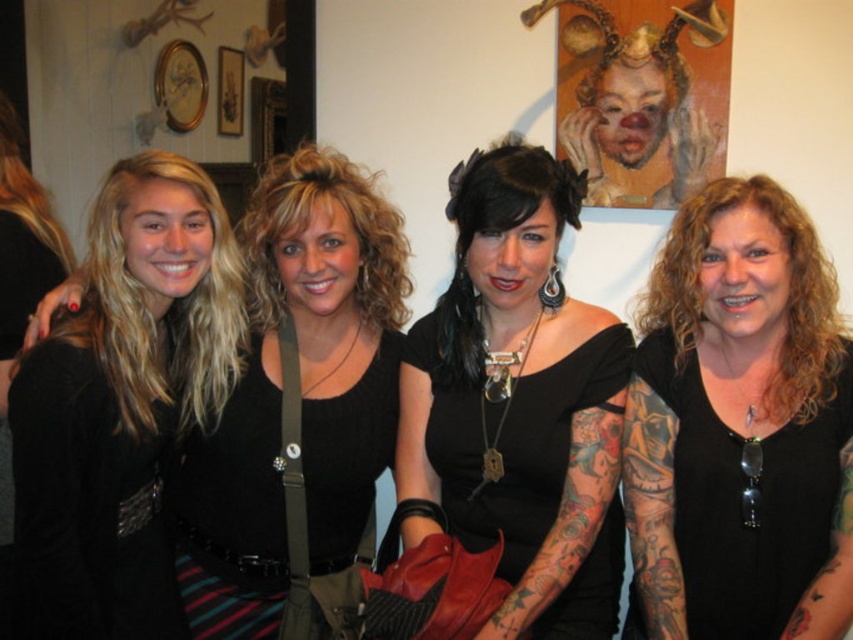
Is black leather jacket at left wider than black knit top at center?

In fact, black leather jacket at left might be narrower than black knit top at center.

Can you confirm if black leather jacket at left is positioned to the right of black knit top at center?

In fact, black leather jacket at left is to the left of black knit top at center.

I want to click on black leather jacket at left, so click(x=123, y=403).

I want to click on black leather jacket at left, so click(123, 403).

Between black matte shirt at right and black leather jacket at left, which one has more height?

With more height is black leather jacket at left.

Can you confirm if black matte shirt at right is positioned to the right of black leather jacket at left?

Indeed, black matte shirt at right is positioned on the right side of black leather jacket at left.

What do you see at coordinates (740, 428) in the screenshot?
I see `black matte shirt at right` at bounding box center [740, 428].

Identify the location of black matte shirt at right. (740, 428).

Is black leather purse at center taller than black leather jacket at left?

No, black leather purse at center is not taller than black leather jacket at left.

Which is more to the left, black leather purse at center or black leather jacket at left?

black leather jacket at left

This screenshot has height=640, width=853. I want to click on black leather purse at center, so click(x=518, y=404).